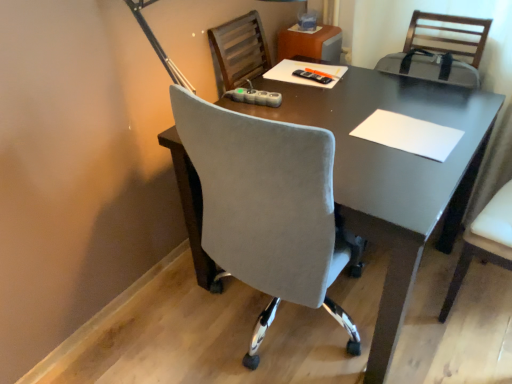
Find the location of a particular element. The width and height of the screenshot is (512, 384). unoccupied space behind white paper at center is located at coordinates (388, 96).